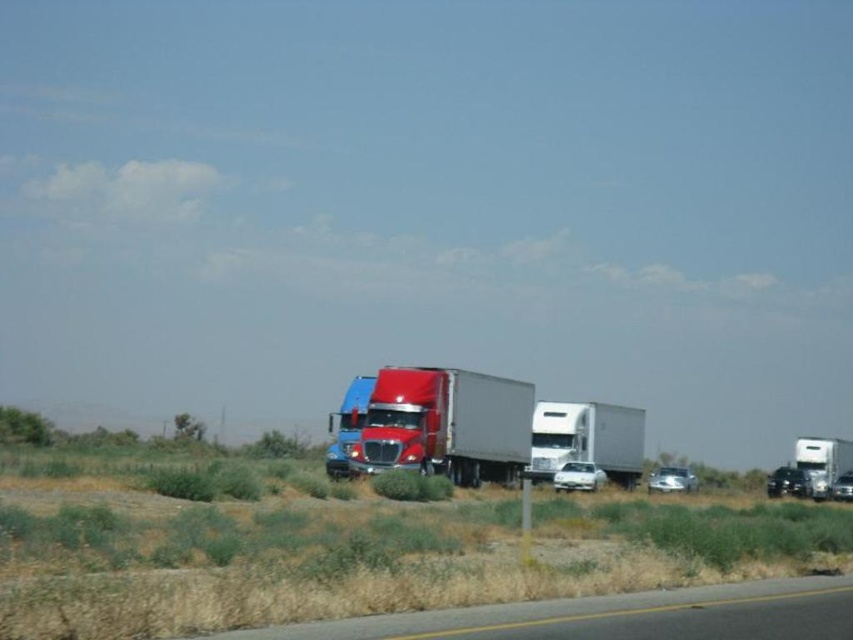
Can you confirm if gray asphalt road at lower center is taller than white matte trailer truck at center?

In fact, gray asphalt road at lower center may be shorter than white matte trailer truck at center.

Measure the distance between gray asphalt road at lower center and white matte trailer truck at center.

gray asphalt road at lower center and white matte trailer truck at center are 40.07 meters apart.

Find the location of a particular element. This screenshot has width=853, height=640. gray asphalt road at lower center is located at coordinates click(x=614, y=616).

From the picture: Does metallic silver trailer truck at center have a greater width compared to white matte trailer truck at center?

Correct, the width of metallic silver trailer truck at center exceeds that of white matte trailer truck at center.

Which of these two, metallic silver trailer truck at center or white matte trailer truck at center, stands taller?

metallic silver trailer truck at center

Who is more forward, (361, 449) or (548, 445)?

Point (361, 449) is more forward.

This screenshot has height=640, width=853. Identify the location of metallic silver trailer truck at center. (445, 424).

In the scene shown: Does gray asphalt road at lower center appear under metallic silver trailer truck at center?

No.

Which is more to the right, gray asphalt road at lower center or metallic silver trailer truck at center?

Positioned to the right is gray asphalt road at lower center.

This screenshot has width=853, height=640. Identify the location of gray asphalt road at lower center. (614, 616).